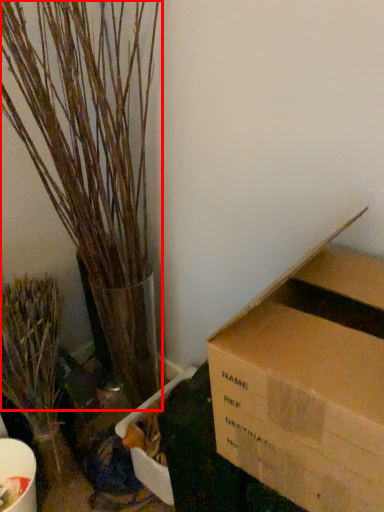
Question: From the image, what is the correct spatial relationship of houseplant (annotated by the red box) in relation to houseplant?

Choices:
 (A) right
 (B) left

Answer: (A)